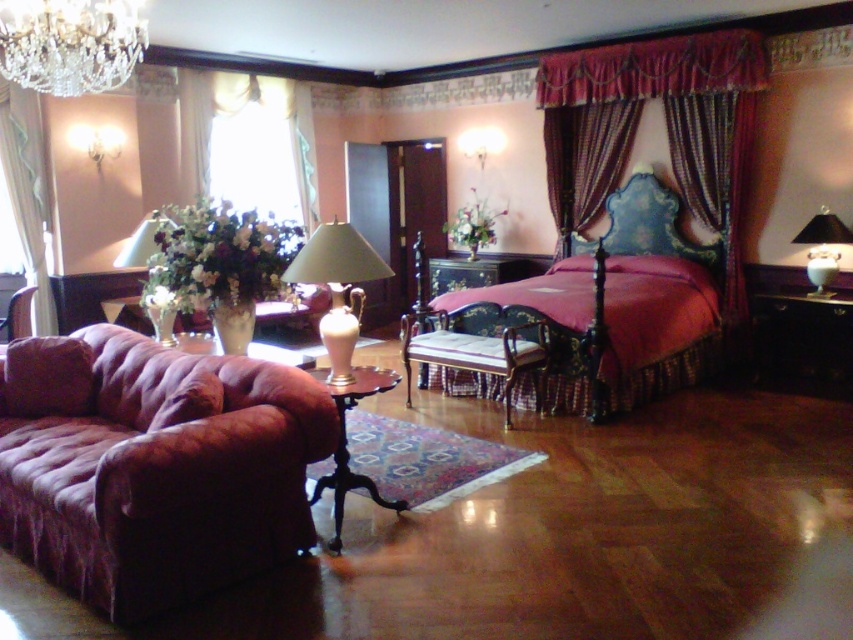
Measure the distance between point [19,26] and camera.

3.14 meters

From the picture: Who is positioned more to the left, crystal glass chandelier at upper left or wooden polished armchair at center?

crystal glass chandelier at upper left

Between point (134, 26) and point (540, 378), which one is positioned behind?

The point (540, 378) is behind.

This screenshot has width=853, height=640. Find the location of `crystal glass chandelier at upper left`. crystal glass chandelier at upper left is located at coordinates (70, 44).

Consider the image. Does crystal glass chandelier at upper left have a greater height compared to white sheer curtain at left?

In fact, crystal glass chandelier at upper left may be shorter than white sheer curtain at left.

Does crystal glass chandelier at upper left have a smaller size compared to white sheer curtain at left?

Actually, crystal glass chandelier at upper left might be larger than white sheer curtain at left.

Is point (70, 54) behind point (3, 140)?

No, it is not.

Find the location of `crystal glass chandelier at upper left`. crystal glass chandelier at upper left is located at coordinates (70, 44).

Which is behind, point (520, 324) or point (35, 314)?

Point (35, 314)

Find the location of a particular element. The width and height of the screenshot is (853, 640). wooden polished armchair at center is located at coordinates (479, 342).

Find the location of a particular element. wooden polished armchair at center is located at coordinates (479, 342).